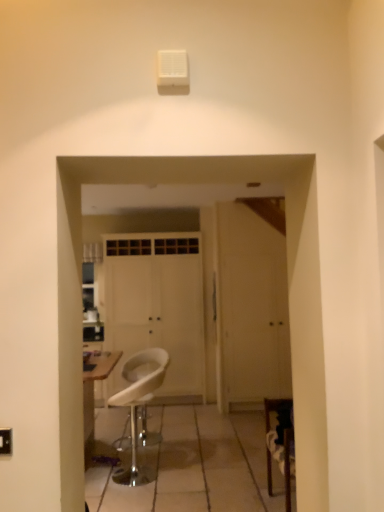
Question: Can you confirm if white plastic stool at center is bigger than white matte door at center, which is the first door in right-to-left order?

Choices:
 (A) yes
 (B) no

Answer: (B)

Question: Can you confirm if white plastic stool at center is wider than white matte door at center, which is the first door in right-to-left order?

Choices:
 (A) no
 (B) yes

Answer: (A)

Question: Considering the relative sizes of white plastic stool at center and white matte door at center, which is the first door in right-to-left order, in the image provided, is white plastic stool at center smaller than white matte door at center, which is the first door in right-to-left order,?

Choices:
 (A) yes
 (B) no

Answer: (A)

Question: From a real-world perspective, is white plastic stool at center on white matte door at center, placed as the second door when sorted from left to right?

Choices:
 (A) no
 (B) yes

Answer: (A)

Question: Can you confirm if white plastic stool at center is shorter than white matte door at center, which is the first door in right-to-left order?

Choices:
 (A) yes
 (B) no

Answer: (A)

Question: From the image's perspective, is white matte door at center, which is the first door in right-to-left order, above or below white matte door at center, marked as the 1th door in a left-to-right arrangement?

Choices:
 (A) below
 (B) above

Answer: (A)

Question: Is white matte door at center, placed as the second door when sorted from left to right, in front of or behind white matte door at center, marked as the 1th door in a left-to-right arrangement, in the image?

Choices:
 (A) front
 (B) behind

Answer: (A)

Question: Is white matte door at center, which is the first door in right-to-left order, inside the boundaries of white matte door at center, the 2th door from the right, or outside?

Choices:
 (A) inside
 (B) outside

Answer: (B)

Question: Is white matte door at center, placed as the second door when sorted from left to right, wider or thinner than white matte door at center, marked as the 1th door in a left-to-right arrangement?

Choices:
 (A) wide
 (B) thin

Answer: (B)

Question: Considering the positions of point (182, 300) and point (264, 329), is point (182, 300) closer or farther from the camera than point (264, 329)?

Choices:
 (A) farther
 (B) closer

Answer: (A)

Question: In the image, is white matte door at center, the 2th door from the right, positioned in front of or behind white matte door at center, placed as the second door when sorted from left to right?

Choices:
 (A) behind
 (B) front

Answer: (A)

Question: Looking at their shapes, would you say white matte door at center, marked as the 1th door in a left-to-right arrangement, is wider or thinner than white matte door at center, which is the first door in right-to-left order?

Choices:
 (A) wide
 (B) thin

Answer: (A)

Question: Considering the positions of white matte door at center, the 2th door from the right, and white matte door at center, placed as the second door when sorted from left to right, in the image, is white matte door at center, the 2th door from the right, bigger or smaller than white matte door at center, placed as the second door when sorted from left to right,?

Choices:
 (A) small
 (B) big

Answer: (B)

Question: From the image's perspective, is white plastic stool at center located above or below white matte door at center, which is the first door in right-to-left order?

Choices:
 (A) below
 (B) above

Answer: (A)

Question: Is white plastic stool at center spatially inside white matte door at center, which is the first door in right-to-left order, or outside of it?

Choices:
 (A) outside
 (B) inside

Answer: (A)